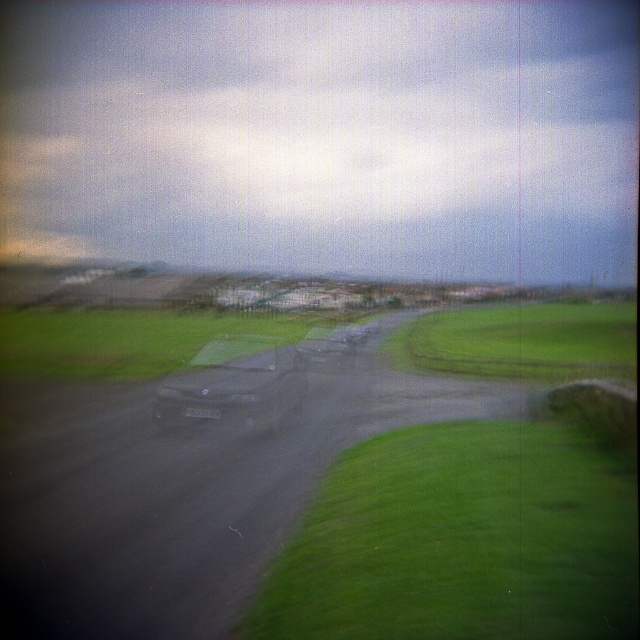
Question: Which point appears closest to the camera in this image?

Choices:
 (A) (516, 442)
 (B) (333, 339)

Answer: (A)

Question: Which point is farther from the camera taking this photo?

Choices:
 (A) (138, 328)
 (B) (484, 636)
 (C) (186, 410)
 (D) (348, 353)

Answer: (A)

Question: Estimate the real-world distances between objects in this image. Which object is farther from the green grassy at lower right?

Choices:
 (A) shiny silver car at center
 (B) shiny metallic car at center

Answer: (A)

Question: Does green grassy at lower right have a larger size compared to shiny silver car at center?

Choices:
 (A) no
 (B) yes

Answer: (A)

Question: Does shiny metallic car at center appear over shiny silver car at center?

Choices:
 (A) yes
 (B) no

Answer: (B)

Question: Is green grassy at lower right behind shiny metallic car at center?

Choices:
 (A) no
 (B) yes

Answer: (A)